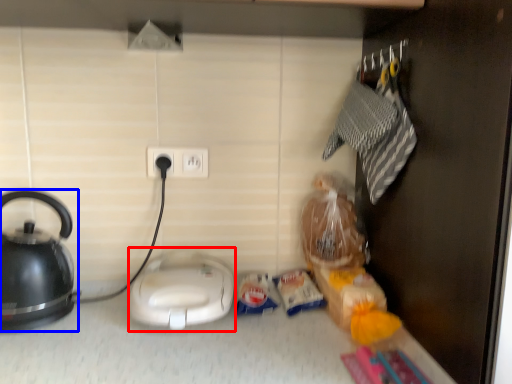
Question: Which object is closer to the camera taking this photo, appliance (highlighted by a red box) or kettle (highlighted by a blue box)?

Choices:
 (A) appliance
 (B) kettle

Answer: (B)